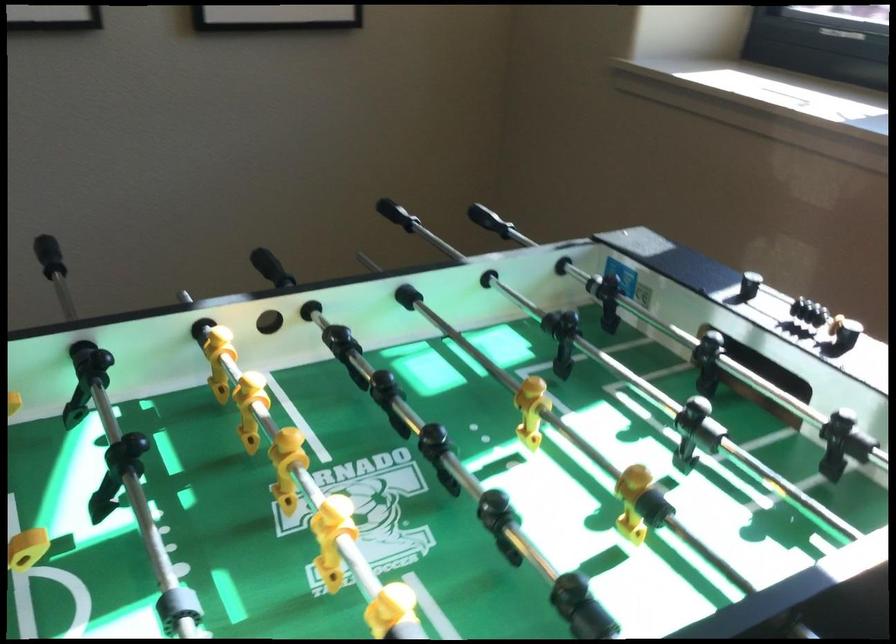
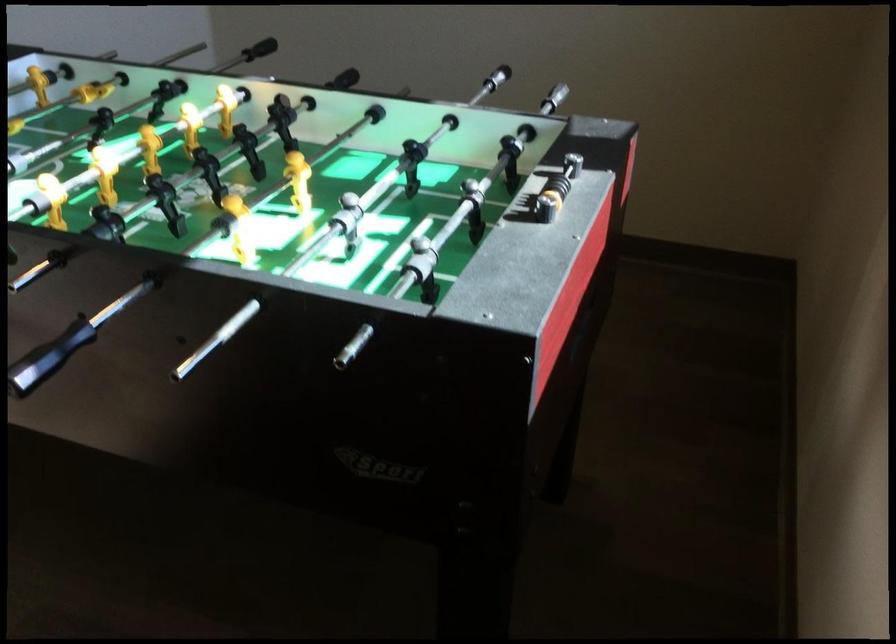
In the second image, find the point that corresponds to (247,223) in the first image.

(554, 98)